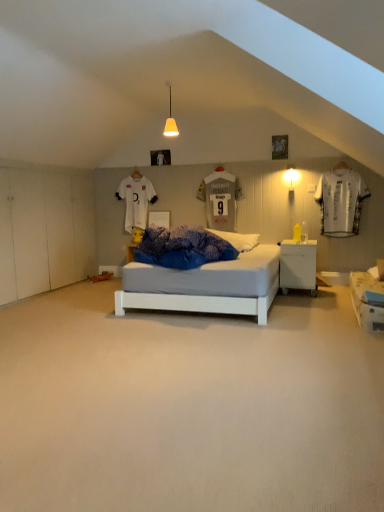
Question: Is white jersey at right completely or partially inside matte yellow cone at upper center?

Choices:
 (A) no
 (B) yes

Answer: (A)

Question: Is the position of matte yellow cone at upper center more distant than that of white jersey at right?

Choices:
 (A) no
 (B) yes

Answer: (A)

Question: Considering the relative sizes of matte yellow cone at upper center and white jersey at right in the image provided, is matte yellow cone at upper center smaller than white jersey at right?

Choices:
 (A) yes
 (B) no

Answer: (A)

Question: Is matte yellow cone at upper center thinner than white jersey at right?

Choices:
 (A) no
 (B) yes

Answer: (A)

Question: Does matte yellow cone at upper center have a greater height compared to white jersey at right?

Choices:
 (A) yes
 (B) no

Answer: (B)

Question: In the image, is white carpet at center positioned in front of or behind matte yellow cone at upper center?

Choices:
 (A) behind
 (B) front

Answer: (B)

Question: From a real-world perspective, is white carpet at center positioned above or below matte yellow cone at upper center?

Choices:
 (A) above
 (B) below

Answer: (B)

Question: From their relative heights in the image, would you say white carpet at center is taller or shorter than matte yellow cone at upper center?

Choices:
 (A) tall
 (B) short

Answer: (B)

Question: From the image's perspective, is white carpet at center above or below matte yellow cone at upper center?

Choices:
 (A) below
 (B) above

Answer: (A)

Question: Would you say matte yellow cone at upper center is inside or outside white carpet at center?

Choices:
 (A) inside
 (B) outside

Answer: (B)

Question: Relative to white carpet at center, is matte yellow cone at upper center in front or behind?

Choices:
 (A) behind
 (B) front

Answer: (A)

Question: Based on their positions, is matte yellow cone at upper center located to the left or right of white carpet at center?

Choices:
 (A) left
 (B) right

Answer: (B)

Question: From the image's perspective, relative to white carpet at center, is matte yellow cone at upper center above or below?

Choices:
 (A) above
 (B) below

Answer: (A)

Question: Which is correct: white jersey at right is inside white glossy nightstand at center, or outside of it?

Choices:
 (A) outside
 (B) inside

Answer: (A)

Question: Considering their positions, is white jersey at right located in front of or behind white glossy nightstand at center?

Choices:
 (A) front
 (B) behind

Answer: (B)